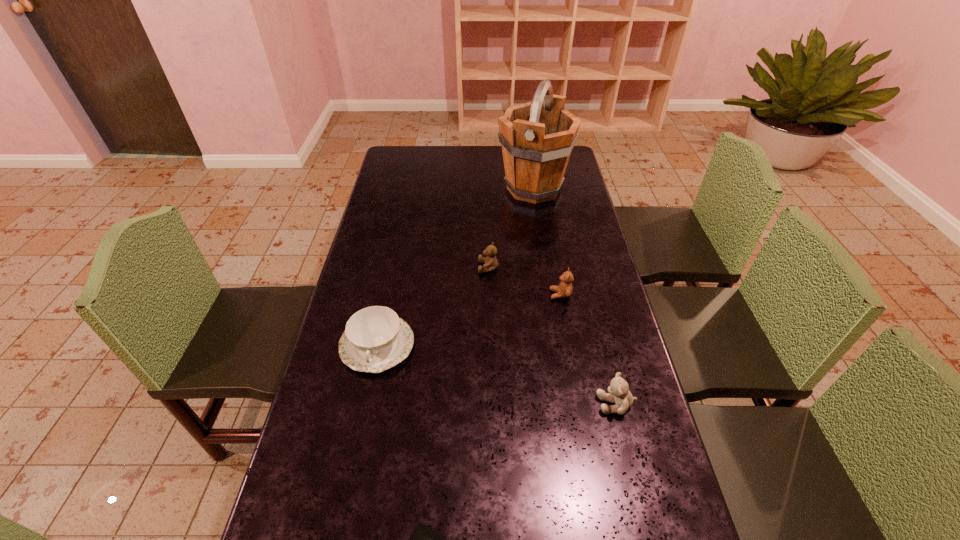
Identify the location of vacant space located 0.350m on the left of the farthest object. (410, 189).

The height and width of the screenshot is (540, 960). In order to click on free space located 0.180m on the face of the second teddy bear from right to left in this screenshot , I will do [x=492, y=294].

Where is `vacant space located 0.080m on the face of the second teddy bear from right to left`? The image size is (960, 540). vacant space located 0.080m on the face of the second teddy bear from right to left is located at coordinates (524, 294).

Where is `vacant area located 0.110m on the face of the second teddy bear from right to left`? vacant area located 0.110m on the face of the second teddy bear from right to left is located at coordinates (515, 294).

You are a GUI agent. You are given a task and a screenshot of the screen. Output one action in this format:
    pyautogui.click(x=<x>, y=<y>)
    Task: Click on the vacant area situated 0.290m on the face of the second nearest object
    The width and height of the screenshot is (960, 540).
    Given the screenshot: What is the action you would take?
    pyautogui.click(x=481, y=404)

Where is `free location located 0.300m on the face of the second nearest object`? free location located 0.300m on the face of the second nearest object is located at coordinates 476,404.

Find the location of a particular element. The height and width of the screenshot is (540, 960). free spot located 0.150m on the face of the second nearest object is located at coordinates pyautogui.click(x=537, y=404).

Locate an element on the screen. vacant space located 0.090m on the front-facing side of the leftmost teddy bear is located at coordinates (451, 267).

Locate an element on the screen. free space located 0.350m on the front-facing side of the leftmost teddy bear is located at coordinates 372,267.

Where is `free region located on the front-facing side of the leftmost teddy bear`? This screenshot has width=960, height=540. free region located on the front-facing side of the leftmost teddy bear is located at coordinates (391, 267).